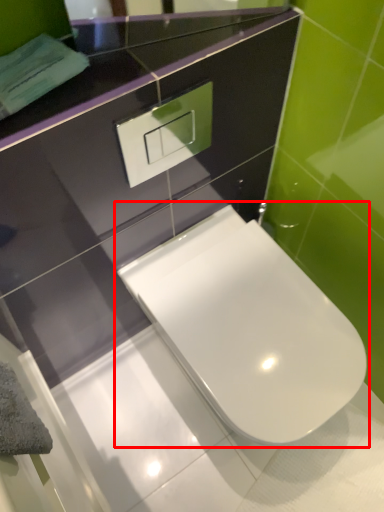
Question: From the image's perspective, what is the correct spatial relationship of toilet (annotated by the red box) in relation to mirror?

Choices:
 (A) below
 (B) above

Answer: (A)